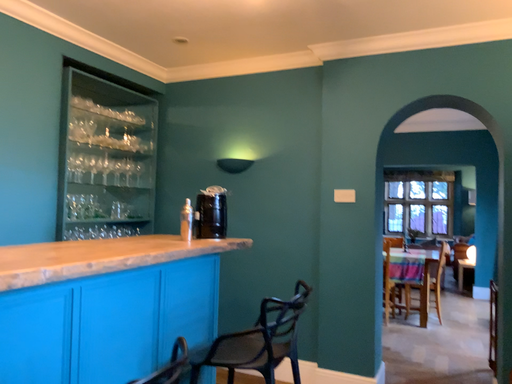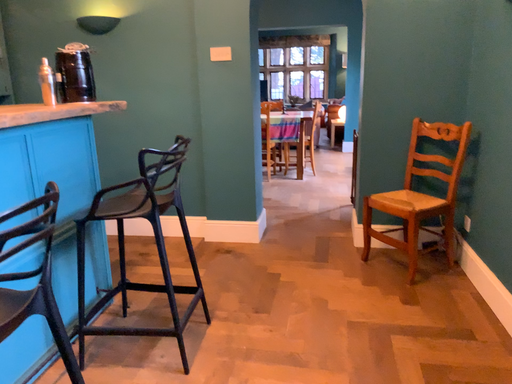
Question: How did the camera likely rotate when shooting the video?

Choices:
 (A) rotated right
 (B) rotated left

Answer: (A)